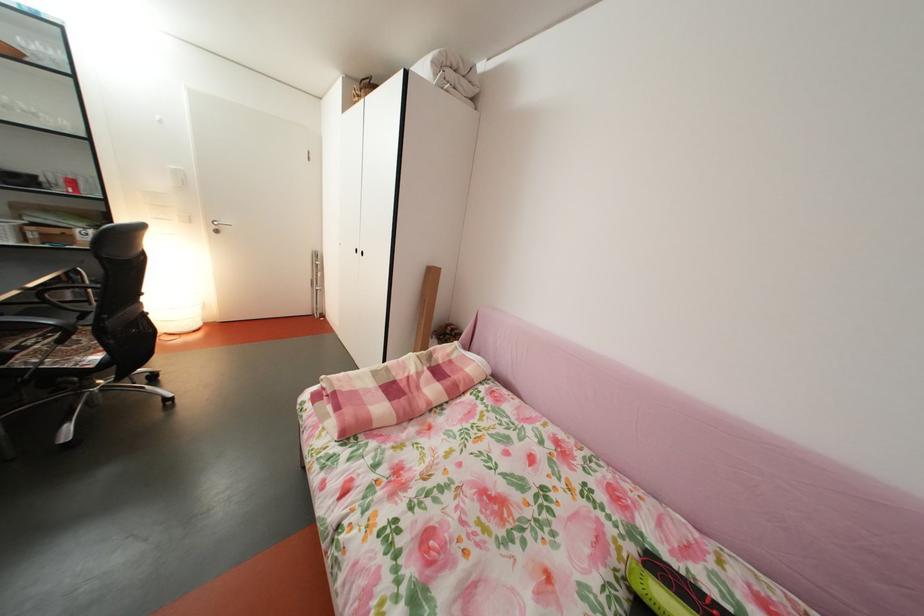
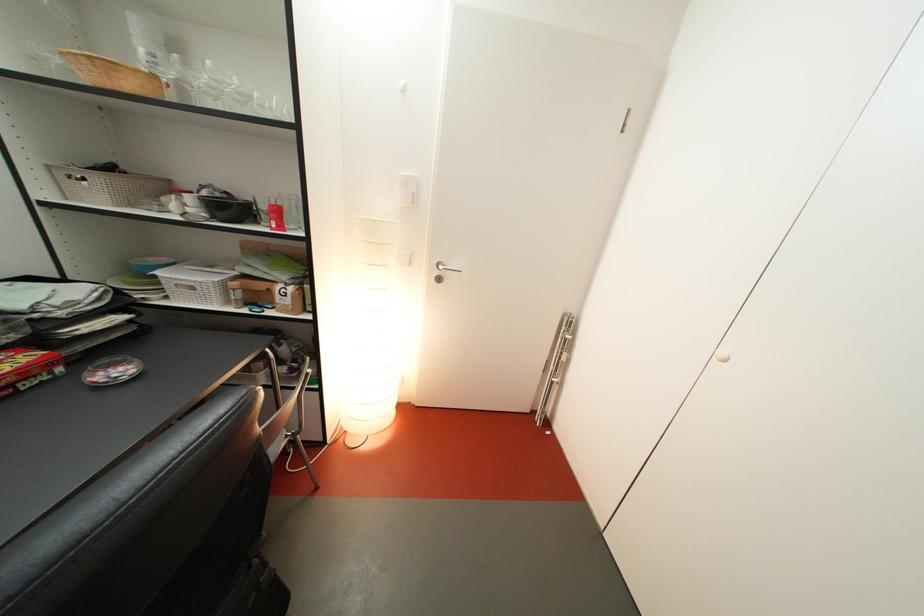
Where in the second image is the point corresponding to [44,243] from the first image?

(249, 301)